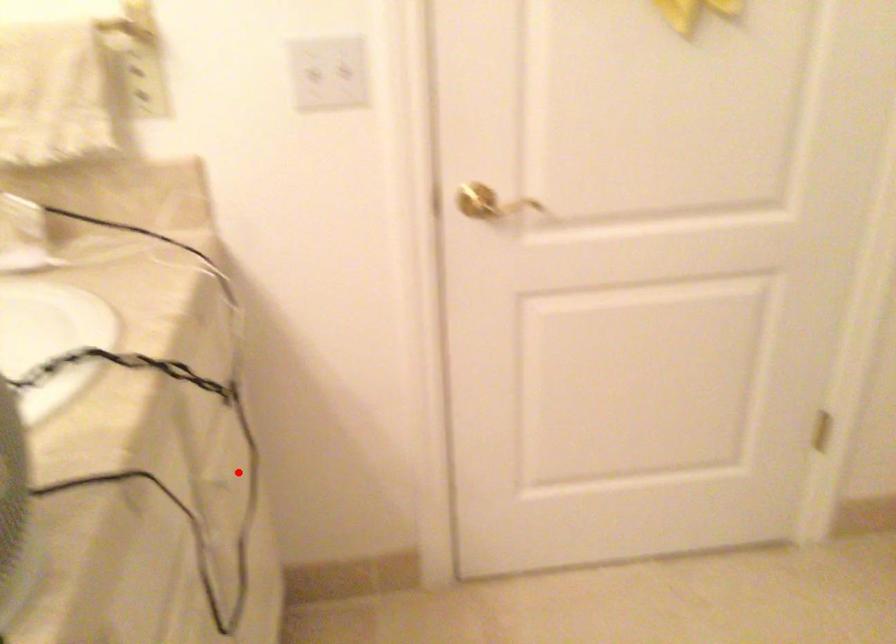
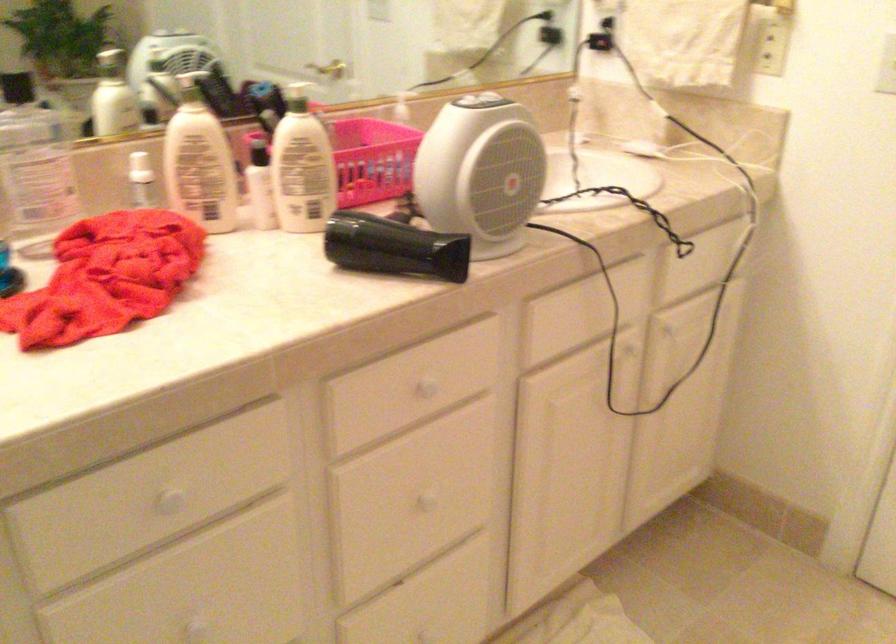
Question: I am providing you with two images of the same scene from different viewpoints. Given a red point in image1, look at the same physical point in image2. Is it:

Choices:
 (A) Closer to the viewpoint
 (B) Farther from the viewpoint

Answer: (B)